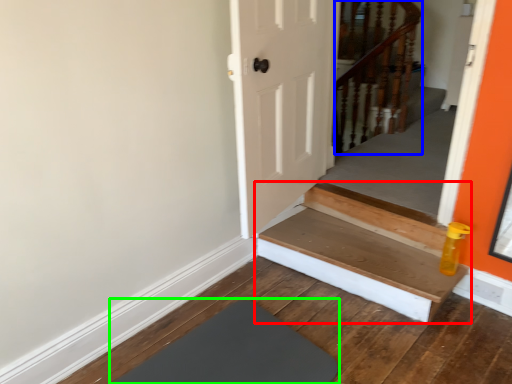
Question: Which is nearer to the stairs (highlighted by a red box)? rail (highlighted by a blue box) or mat (highlighted by a green box).

Choices:
 (A) rail
 (B) mat

Answer: (B)